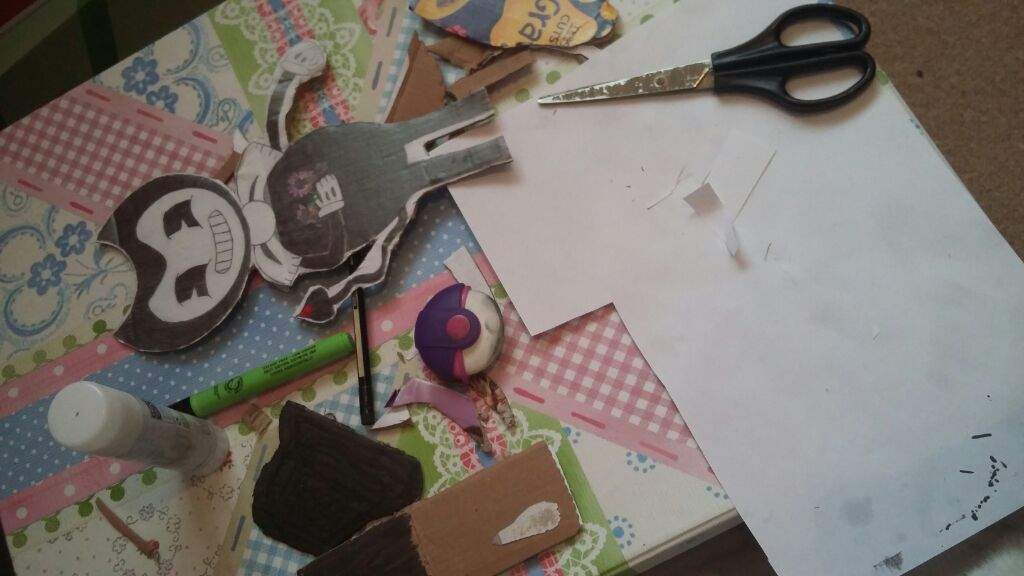
You are a GUI agent. You are given a task and a screenshot of the screen. Output one action in this format:
    pyautogui.click(x=<x>, y=<y>)
    Task: Click on the table surface cover
    The image size is (1024, 576).
    Given the screenshot: What is the action you would take?
    pyautogui.click(x=220, y=44)